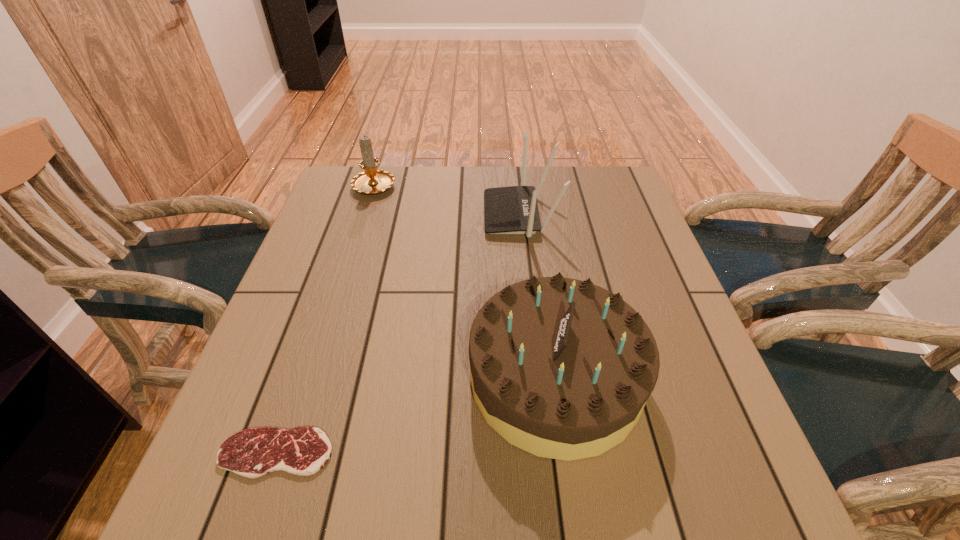
This screenshot has height=540, width=960. I want to click on vacant area that lies between the router and the candle, so click(447, 200).

The height and width of the screenshot is (540, 960). I want to click on blank region between the shortest object and the candle, so click(x=325, y=319).

Find the location of a particular element. Image resolution: width=960 pixels, height=540 pixels. free space between the steak and the router is located at coordinates (398, 334).

This screenshot has height=540, width=960. In order to click on free space between the router and the candle in this screenshot , I will do `click(447, 200)`.

Where is `vacant area that lies between the router and the shortest object`? vacant area that lies between the router and the shortest object is located at coordinates (398, 334).

At what (x,y) coordinates should I click in order to perform the action: click on the second closest object to the steak. Please return your answer as a coordinate pair (x, y). The image size is (960, 540). Looking at the image, I should click on (507, 210).

Point out which object is positioned as the third nearest to the router. Please provide its 2D coordinates. Your answer should be formatted as a tuple, i.e. [(x, y)], where the tuple contains the x and y coordinates of a point satisfying the conditions above.

[(303, 451)]

The width and height of the screenshot is (960, 540). What are the coordinates of `vacant point that satisfies the following two spatial constraints: 1. on the front-facing side of the router; 2. on the front side of the shortest object` in the screenshot? It's located at click(x=547, y=453).

What are the coordinates of `vacant space that satisfies the following two spatial constraints: 1. on the back side of the candle; 2. on the left side of the shortest object` in the screenshot? It's located at (367, 185).